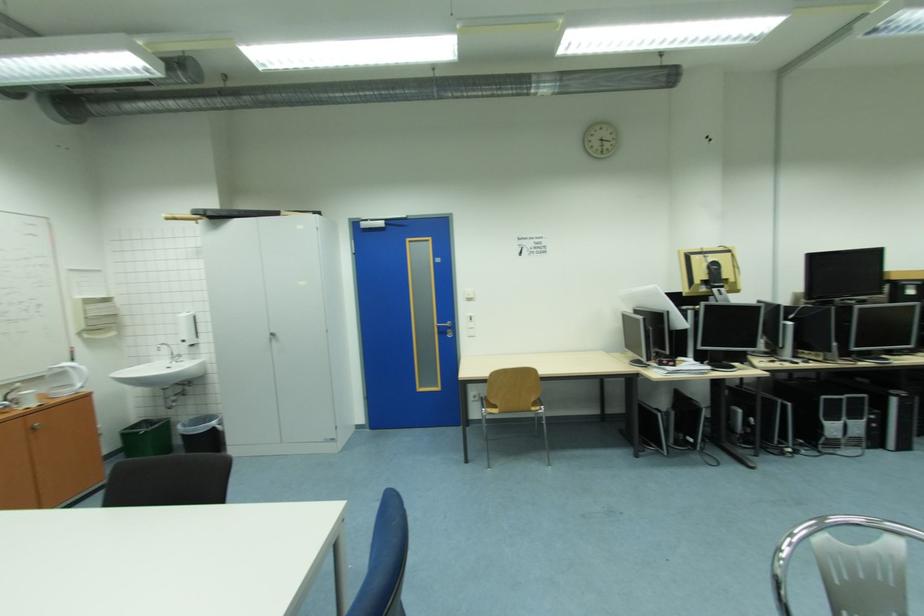
This screenshot has width=924, height=616. What are the coordinates of `chair sitting surface` in the screenshot? It's located at (512, 406).